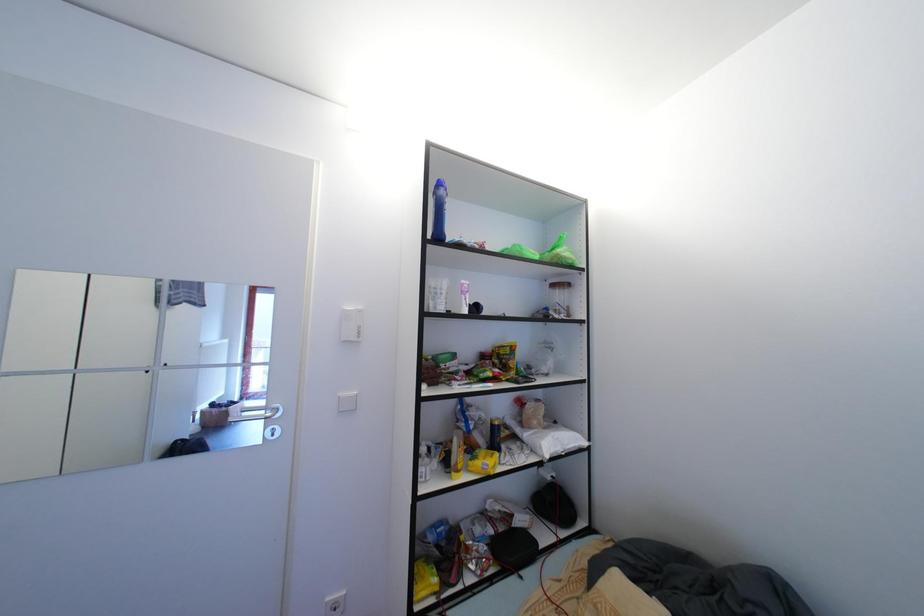
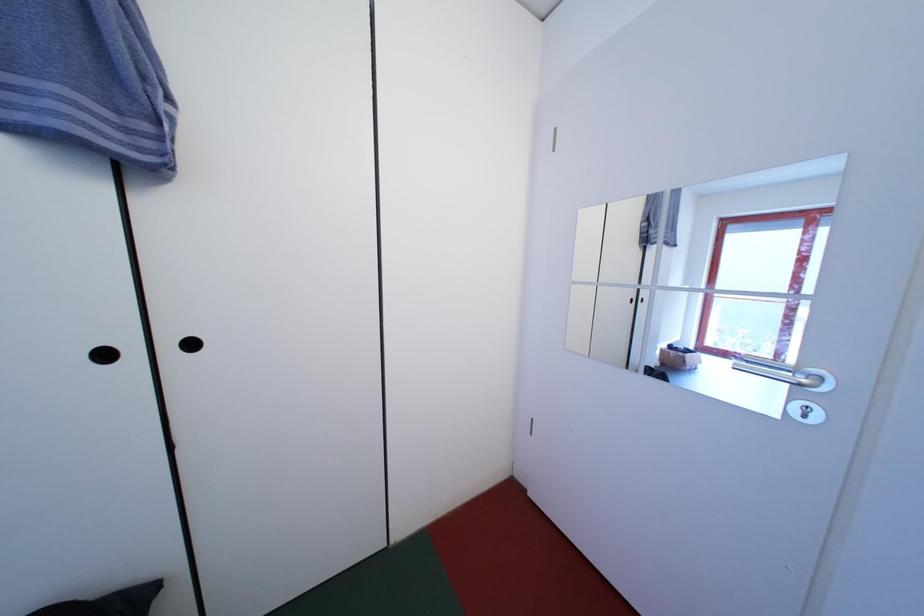
Question: Based on the continuous images, in which direction is the camera rotating? Reply with the corresponding letter.

Choices:
 (A) Left
 (B) Right
 (C) Up
 (D) Down

Answer: (A)